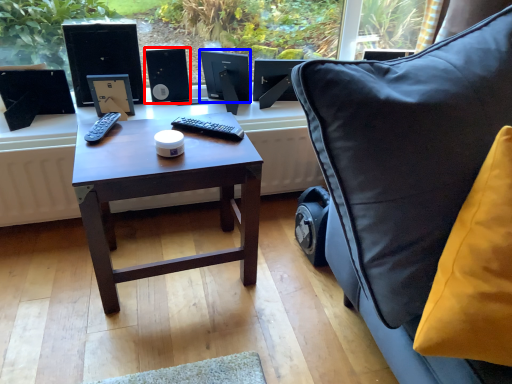
Question: Which object appears closest to the camera in this image, speaker (highlighted by a red box) or computer monitor (highlighted by a blue box)?

Choices:
 (A) speaker
 (B) computer monitor

Answer: (B)